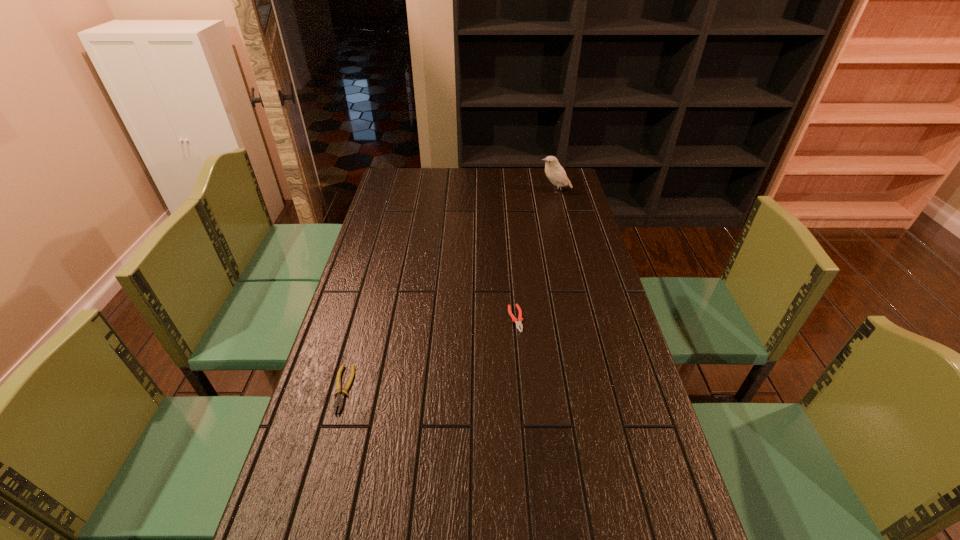
The height and width of the screenshot is (540, 960). In order to click on object that stands as the second closest to the second object from right to left in this screenshot , I will do `click(554, 171)`.

You are a GUI agent. You are given a task and a screenshot of the screen. Output one action in this format:
    pyautogui.click(x=<x>, y=<y>)
    Task: Click on the free point that satisfies the following two spatial constraints: 1. on the back side of the second nearest object; 2. on the right side of the nearest object
    The width and height of the screenshot is (960, 540).
    Given the screenshot: What is the action you would take?
    pyautogui.click(x=362, y=319)